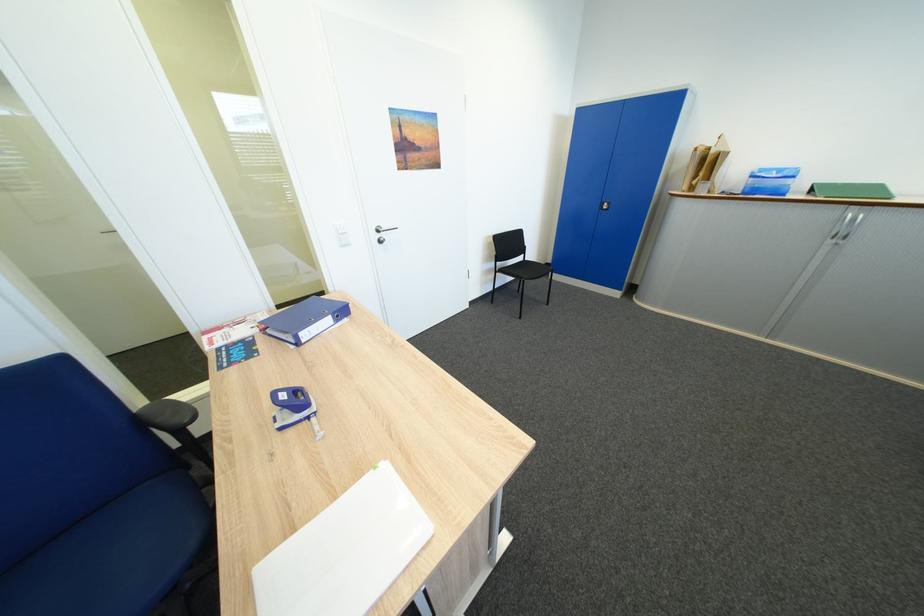
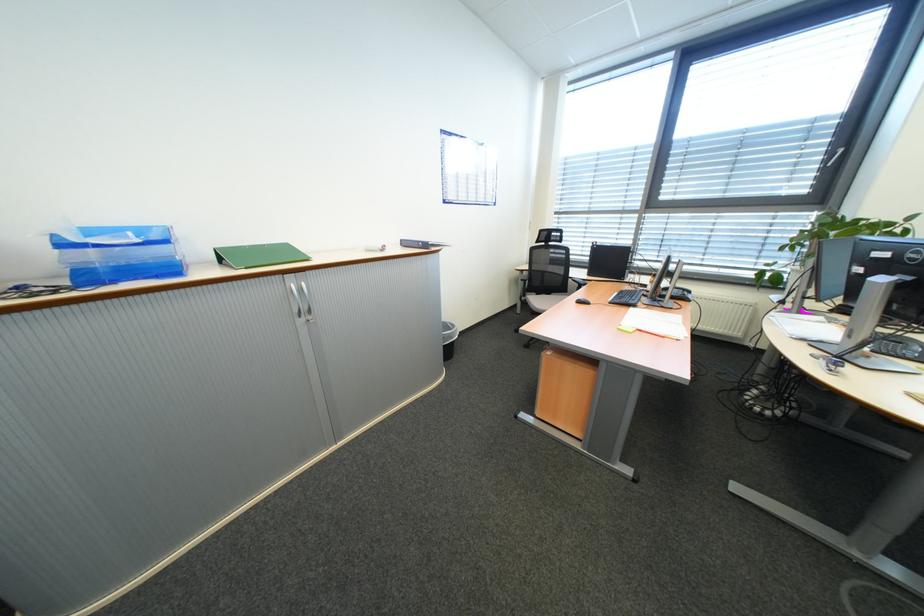
Locate, in the second image, the point that corresponds to the point at 861,216 in the first image.

(302, 286)